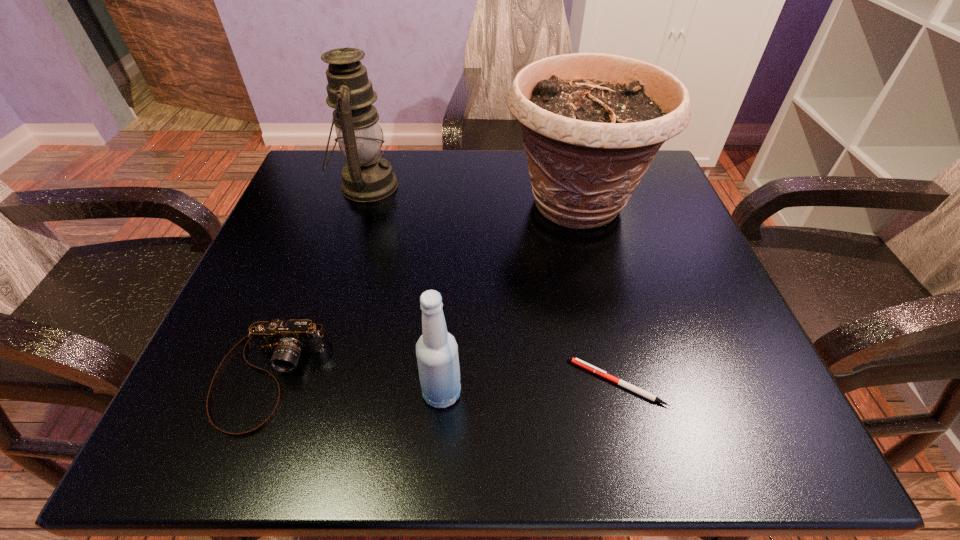
Locate an element on the screen. The width and height of the screenshot is (960, 540). free space located on the clicker of the pen is located at coordinates (300, 382).

The width and height of the screenshot is (960, 540). What are the coordinates of `vacant area situated on the clicker of the pen` in the screenshot? It's located at (503, 382).

At what (x,y) coordinates should I click in order to perform the action: click on oil lamp that is at the far edge. Please return your answer as a coordinate pair (x, y). The image size is (960, 540). Looking at the image, I should click on (367, 177).

Find the location of `flowerpot that is positioned at the far edge`. flowerpot that is positioned at the far edge is located at coordinates (592, 123).

Where is `bottle positioned at the near edge`? bottle positioned at the near edge is located at coordinates (436, 350).

What are the coordinates of `camera that is positioned at the near edge` in the screenshot? It's located at point(286,340).

You are a GUI agent. You are given a task and a screenshot of the screen. Output one action in this format:
    pyautogui.click(x=<x>, y=<y>)
    Task: Click on the pen at the near edge
    The width and height of the screenshot is (960, 540).
    Given the screenshot: What is the action you would take?
    pyautogui.click(x=602, y=373)

You are a GUI agent. You are given a task and a screenshot of the screen. Output one action in this format:
    pyautogui.click(x=<x>, y=<y>)
    Task: Click on the oil lamp that is at the left edge
    
    Given the screenshot: What is the action you would take?
    tap(367, 177)

This screenshot has height=540, width=960. What are the coordinates of `camera present at the left edge` in the screenshot? It's located at (286, 340).

The width and height of the screenshot is (960, 540). Find the location of `flowerpot that is at the right edge`. flowerpot that is at the right edge is located at coordinates (592, 123).